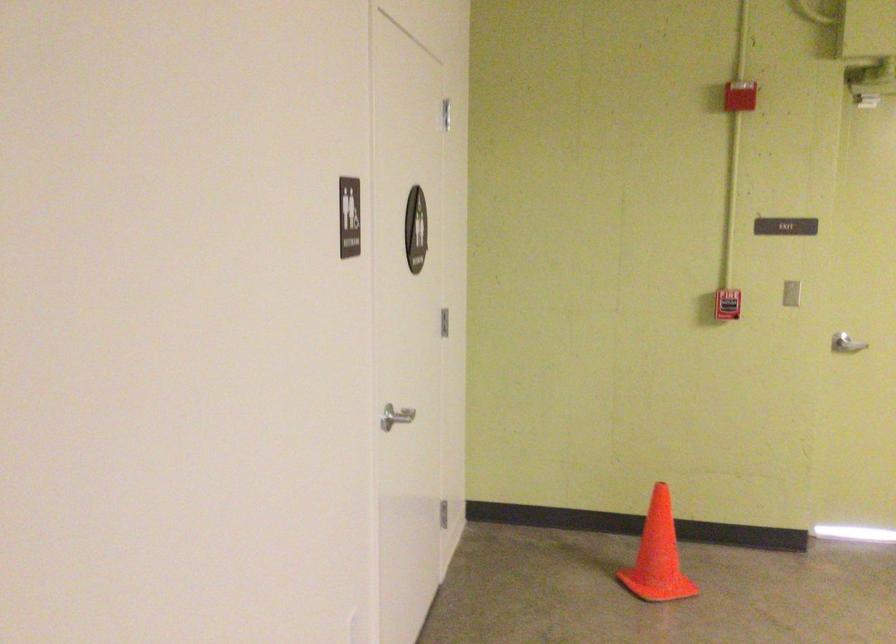
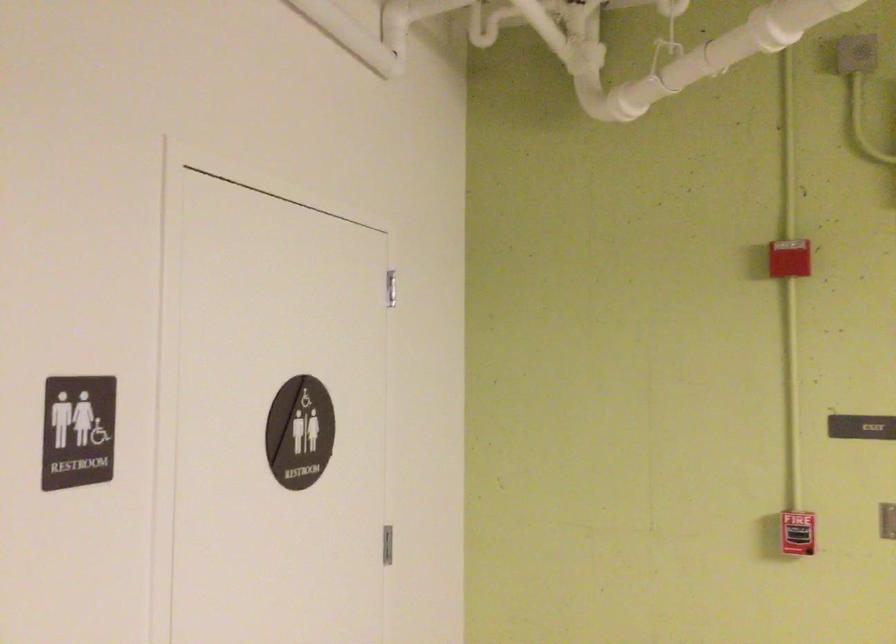
In the second image, find the point that corresponds to pixel 742 301 in the first image.

(797, 533)